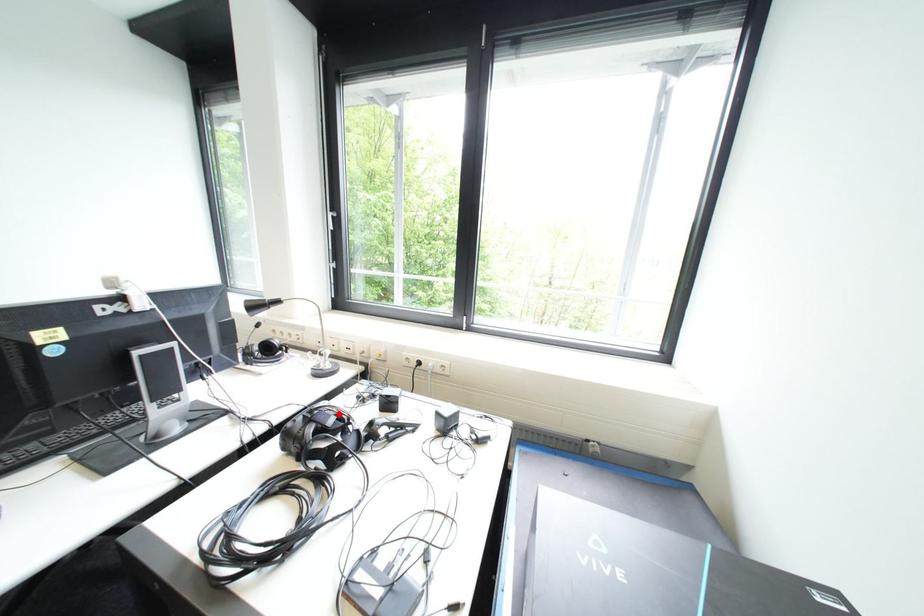
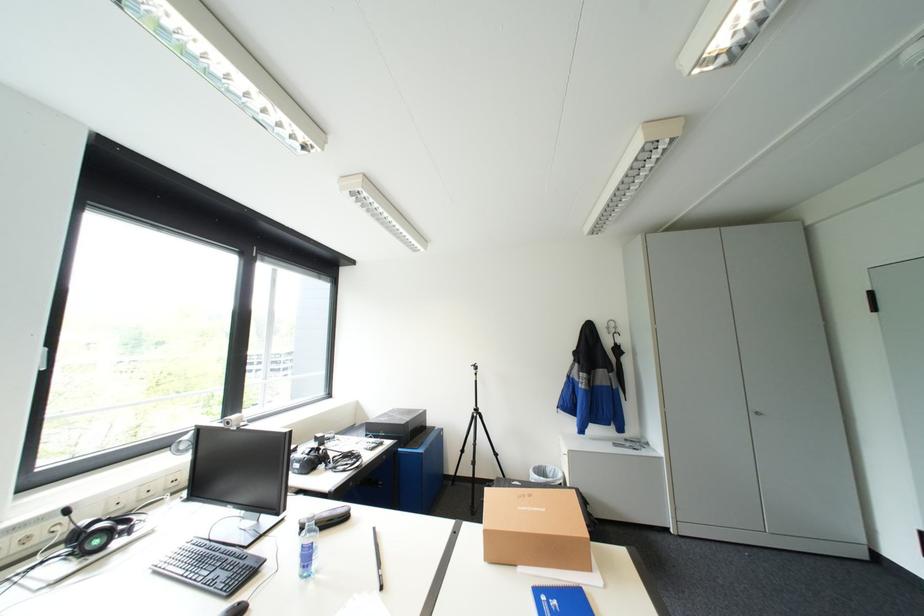
Question: I am providing you with two images of the same scene from different viewpoints. A red point is marked on the first image. Can you still see the location of the red point in image 2?

Choices:
 (A) Yes
 (B) No

Answer: (B)